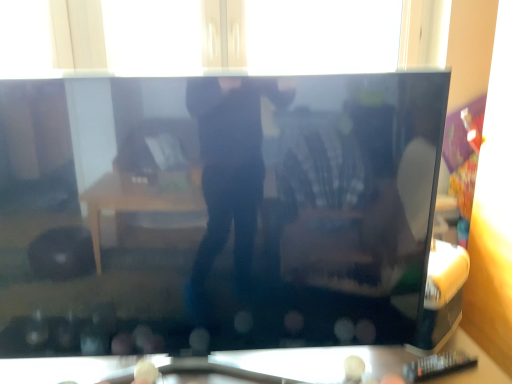
Question: From a real-world perspective, is transparent glass table at lower center below black glossy television at center?

Choices:
 (A) yes
 (B) no

Answer: (A)

Question: Does transparent glass table at lower center come behind black glossy television at center?

Choices:
 (A) yes
 (B) no

Answer: (A)

Question: From the image's perspective, would you say transparent glass table at lower center is shown under black glossy television at center?

Choices:
 (A) yes
 (B) no

Answer: (A)

Question: Is transparent glass table at lower center at the left side of black glossy television at center?

Choices:
 (A) no
 (B) yes

Answer: (A)

Question: Is transparent glass table at lower center to the right of black glossy television at center from the viewer's perspective?

Choices:
 (A) yes
 (B) no

Answer: (A)

Question: Considering the relative sizes of transparent glass table at lower center and black glossy television at center in the image provided, is transparent glass table at lower center bigger than black glossy television at center?

Choices:
 (A) yes
 (B) no

Answer: (B)

Question: Considering the relative sizes of transparent glass window at upper center and black glossy television at center in the image provided, is transparent glass window at upper center shorter than black glossy television at center?

Choices:
 (A) yes
 (B) no

Answer: (A)

Question: Is transparent glass window at upper center positioned with its back to black glossy television at center?

Choices:
 (A) no
 (B) yes

Answer: (A)

Question: Is transparent glass window at upper center far from black glossy television at center?

Choices:
 (A) yes
 (B) no

Answer: (B)

Question: Considering the relative positions of transparent glass window at upper center and black glossy television at center in the image provided, is transparent glass window at upper center to the left of black glossy television at center from the viewer's perspective?

Choices:
 (A) no
 (B) yes

Answer: (A)

Question: Can you confirm if transparent glass window at upper center is bigger than black glossy television at center?

Choices:
 (A) no
 (B) yes

Answer: (A)

Question: Does transparent glass window at upper center have a smaller size compared to black glossy television at center?

Choices:
 (A) yes
 (B) no

Answer: (A)

Question: Would you say black glossy television at center contains transparent glass window at upper center?

Choices:
 (A) yes
 (B) no

Answer: (B)